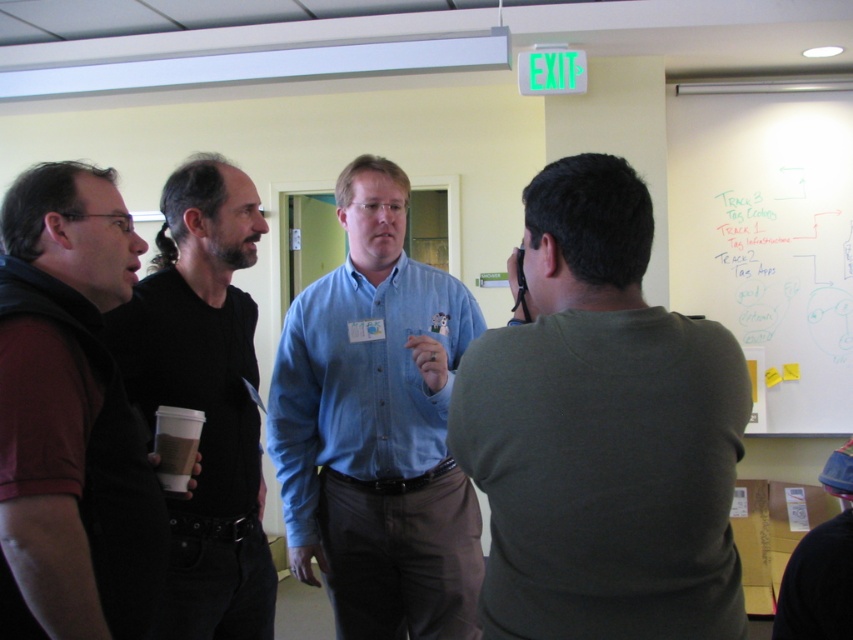
You are standing in the conference room and see two points marked on the whiteboard. The first point is at coordinate point (32,625) and the second is at point (848,246). Which point is closer to you?

The point at (32,625) is closer to you than the point at (848,246).